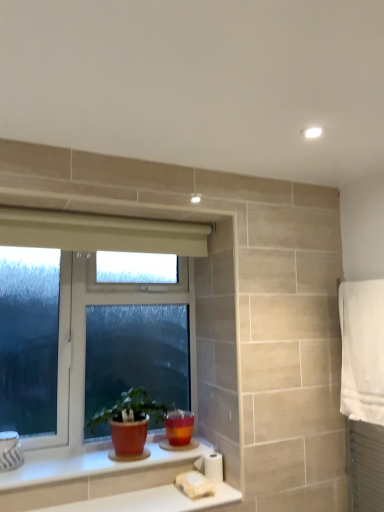
What is the approximate width of white matte toilet paper at lower center?

The width of white matte toilet paper at lower center is 3.74 inches.

Image resolution: width=384 pixels, height=512 pixels. I want to click on white glossy counter top at lower center, acting as the 1th counter top starting from the bottom, so click(155, 500).

Measure the distance between white glossy counter top at lower center, arranged as the second counter top when ordered from the bottom, and camera.

The distance of white glossy counter top at lower center, arranged as the second counter top when ordered from the bottom, from camera is 1.57 meters.

Describe the element at coordinates (99, 291) in the screenshot. This screenshot has height=512, width=384. I see `white plastic window at lower left` at that location.

What is the approximate height of white cotton towel at right?

The height of white cotton towel at right is 23.69 inches.

In order to face white cotton towel at right, should I rotate leftwards or rightwards?

To align with it, rotate right about 22.082°.

Locate an element on the screen. The image size is (384, 512). white matte toilet paper at lower center is located at coordinates (211, 466).

Which is in front, point (118, 430) or point (151, 292)?

The point (118, 430) is closer to the camera.

Consider the image. Which is more to the right, matte terracotta pot at lower center or white plastic window at lower left?

matte terracotta pot at lower center.

Between matte terracotta pot at lower center and white plastic window at lower left, which one has smaller width?

Thinner between the two is white plastic window at lower left.

Are matte terracotta pot at lower center and white plastic window at lower left far apart?

No, matte terracotta pot at lower center is in close proximity to white plastic window at lower left.

Who is shorter, white glossy counter top at lower center, acting as the 1th counter top starting from the bottom, or white cotton towel at right?

With less height is white glossy counter top at lower center, acting as the 1th counter top starting from the bottom.

Does point (122, 504) lie in front of point (348, 333)?

That is True.

Does white glossy counter top at lower center, which is the second counter top in top-to-bottom order, contain white cotton towel at right?

Definitely not — white cotton towel at right is not inside white glossy counter top at lower center, which is the second counter top in top-to-bottom order.

From the image's perspective, which one is positioned lower, white glossy counter top at lower center, which is the second counter top in top-to-bottom order, or white cotton towel at right?

From the image's view, white glossy counter top at lower center, which is the second counter top in top-to-bottom order, is below.

How distant is white cotton towel at right from matte terracotta pot at lower center?

The distance of white cotton towel at right from matte terracotta pot at lower center is 35.12 inches.

Between white cotton towel at right and matte terracotta pot at lower center, which one has smaller width?

With smaller width is white cotton towel at right.

Which point is more forward, (364, 410) or (147, 418)?

The point (364, 410) is closer to the camera.

Is white cotton towel at right turned away from matte terracotta pot at lower center?

white cotton towel at right is not turned away from matte terracotta pot at lower center.

Is white glossy counter top at lower center, which is the first counter top from top to bottom, to the left of white cotton towel at right from the viewer's perspective?

Yes.

Is white glossy counter top at lower center, which is the first counter top from top to bottom, spatially inside white cotton towel at right, or outside of it?

white glossy counter top at lower center, which is the first counter top from top to bottom, is not enclosed by white cotton towel at right.

From a real-world perspective, who is located higher, white glossy counter top at lower center, which is the first counter top from top to bottom, or white cotton towel at right?

white cotton towel at right is physically above.

Does white glossy counter top at lower center, which is the first counter top from top to bottom, come behind white cotton towel at right?

No, it is not.

Do you think white plastic window at lower left is within white glossy counter top at lower center, which is the first counter top from top to bottom, or outside of it?

white plastic window at lower left cannot be found inside white glossy counter top at lower center, which is the first counter top from top to bottom.

Is white plastic window at lower left beside white glossy counter top at lower center, arranged as the second counter top when ordered from the bottom?

No, white plastic window at lower left is not making contact with white glossy counter top at lower center, arranged as the second counter top when ordered from the bottom.

From a real-world perspective, is white plastic window at lower left beneath white glossy counter top at lower center, which is the first counter top from top to bottom?

Actually, white plastic window at lower left is physically above white glossy counter top at lower center, which is the first counter top from top to bottom, in the real world.

Consider the image. Could you tell me if white plastic window at lower left is turned towards white glossy counter top at lower center, arranged as the second counter top when ordered from the bottom?

Yes, white plastic window at lower left is turned towards white glossy counter top at lower center, arranged as the second counter top when ordered from the bottom.

You are a GUI agent. You are given a task and a screenshot of the screen. Output one action in this format:
    pyautogui.click(x=<x>, y=<y>)
    Task: Click on the counter top on the right of matte terracotta pot at lower center
    Image resolution: width=384 pixels, height=512 pixels.
    Given the screenshot: What is the action you would take?
    pyautogui.click(x=155, y=500)

From the image's perspective, who appears lower, matte terracotta pot at lower center or white glossy counter top at lower center, acting as the 1th counter top starting from the bottom?

white glossy counter top at lower center, acting as the 1th counter top starting from the bottom.

Considering the sizes of objects matte terracotta pot at lower center and white glossy counter top at lower center, which is the second counter top in top-to-bottom order, in the image provided, who is taller, matte terracotta pot at lower center or white glossy counter top at lower center, which is the second counter top in top-to-bottom order,?

matte terracotta pot at lower center.

Measure the distance between matte terracotta pot at lower center and white glossy counter top at lower center, acting as the 1th counter top starting from the bottom.

A distance of 25.99 centimeters exists between matte terracotta pot at lower center and white glossy counter top at lower center, acting as the 1th counter top starting from the bottom.

From a real-world perspective, is matte terracotta pot at lower center positioned under white matte toilet paper at lower center based on gravity?

No, from a real-world perspective, matte terracotta pot at lower center is not beneath white matte toilet paper at lower center.

From the image's perspective, which is above, matte terracotta pot at lower center or white matte toilet paper at lower center?

matte terracotta pot at lower center.

Is matte terracotta pot at lower center wider or thinner than white matte toilet paper at lower center?

In the image, matte terracotta pot at lower center appears to be wider than white matte toilet paper at lower center.

Does matte terracotta pot at lower center appear on the right side of white matte toilet paper at lower center?

Incorrect, matte terracotta pot at lower center is not on the right side of white matte toilet paper at lower center.

Identify the location of houseplant below the white plastic window at lower left (from the image's perspective). Image resolution: width=384 pixels, height=512 pixels. pyautogui.click(x=130, y=421).

What are the coordinates of `bath towel above the white glossy counter top at lower center, which is the second counter top in top-to-bottom order (from the image's perspective)` in the screenshot? It's located at (362, 350).

Which object lies nearer to the anchor point white glossy counter top at lower center, acting as the 1th counter top starting from the bottom, white matte toilet paper at lower center or white cotton towel at right?

Among the two, white matte toilet paper at lower center is located nearer to white glossy counter top at lower center, acting as the 1th counter top starting from the bottom.

Estimate the real-world distances between objects in this image. Which object is closer to matte terracotta pot at lower center, white matte toilet paper at lower center or white glossy counter top at lower center, acting as the 1th counter top starting from the bottom?

white glossy counter top at lower center, acting as the 1th counter top starting from the bottom, is closer to matte terracotta pot at lower center.

Estimate the real-world distances between objects in this image. Which object is further from matte terracotta pot at lower center, white plastic window at lower left or white glossy counter top at lower center, which is the second counter top in top-to-bottom order?

white plastic window at lower left.

When comparing their distances from white plastic window at lower left, does white cotton towel at right or white glossy counter top at lower center, acting as the 1th counter top starting from the bottom, seem further?

white cotton towel at right is further to white plastic window at lower left.

Based on their spatial positions, is white glossy counter top at lower center, which is the second counter top in top-to-bottom order, or white glossy counter top at lower center, which is the first counter top from top to bottom, further from white plastic window at lower left?

Among the two, white glossy counter top at lower center, which is the second counter top in top-to-bottom order, is located further to white plastic window at lower left.

From the image, which object appears to be farther from white cotton towel at right, white glossy counter top at lower center, arranged as the second counter top when ordered from the bottom, or white matte toilet paper at lower center?

white glossy counter top at lower center, arranged as the second counter top when ordered from the bottom, lies further to white cotton towel at right than the other object.

Estimate the real-world distances between objects in this image. Which object is closer to white glossy counter top at lower center, acting as the 1th counter top starting from the bottom, white cotton towel at right or matte terracotta pot at lower center?

Based on the image, matte terracotta pot at lower center appears to be nearer to white glossy counter top at lower center, acting as the 1th counter top starting from the bottom.

From the image, which object appears to be nearer to white cotton towel at right, white matte toilet paper at lower center or white glossy counter top at lower center, which is the second counter top in top-to-bottom order?

white matte toilet paper at lower center.

In order to click on counter top situated between white glossy counter top at lower center, which is the first counter top from top to bottom, and white matte toilet paper at lower center from left to right in this screenshot , I will do `click(155, 500)`.

Where is `counter top between white plastic window at lower left and white glossy counter top at lower center, acting as the 1th counter top starting from the bottom, in the up-down direction`? This screenshot has width=384, height=512. counter top between white plastic window at lower left and white glossy counter top at lower center, acting as the 1th counter top starting from the bottom, in the up-down direction is located at coordinates (103, 470).

Identify the location of houseplant between white plastic window at lower left and white matte toilet paper at lower center from left to right. click(130, 421).

Identify the location of counter top between matte terracotta pot at lower center and white cotton towel at right. Image resolution: width=384 pixels, height=512 pixels. (155, 500).